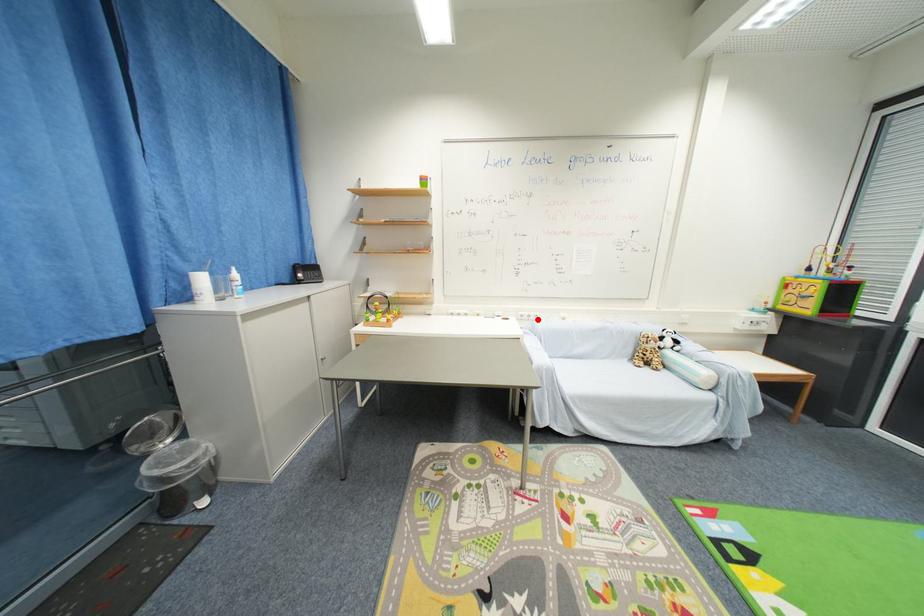
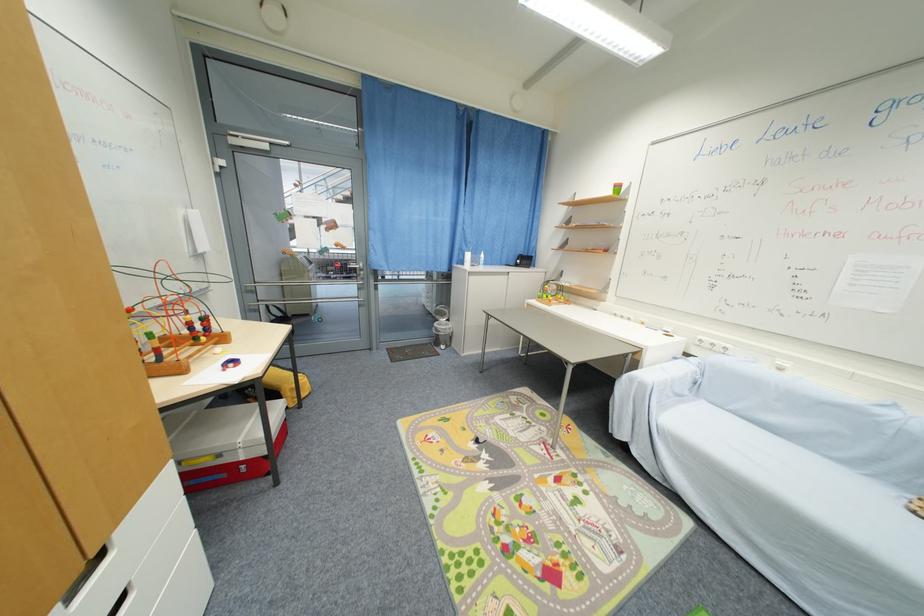
Question: I am providing you with two images of the same scene from different viewpoints. A red point is marked on the first image. Is the red point's position out of view in image 2?

Choices:
 (A) Yes
 (B) No

Answer: (B)